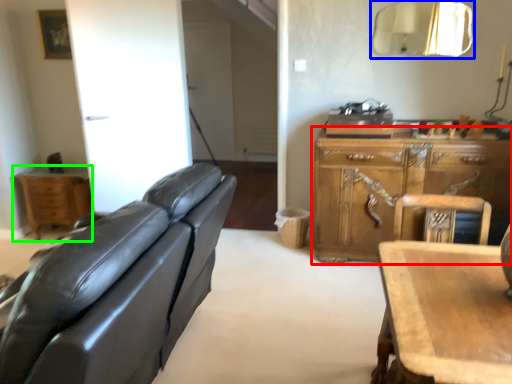
Question: Which object is positioned closest to cabinetry (highlighted by a red box)? Select from mirror (highlighted by a blue box) and nightstand (highlighted by a green box).

Choices:
 (A) mirror
 (B) nightstand

Answer: (A)